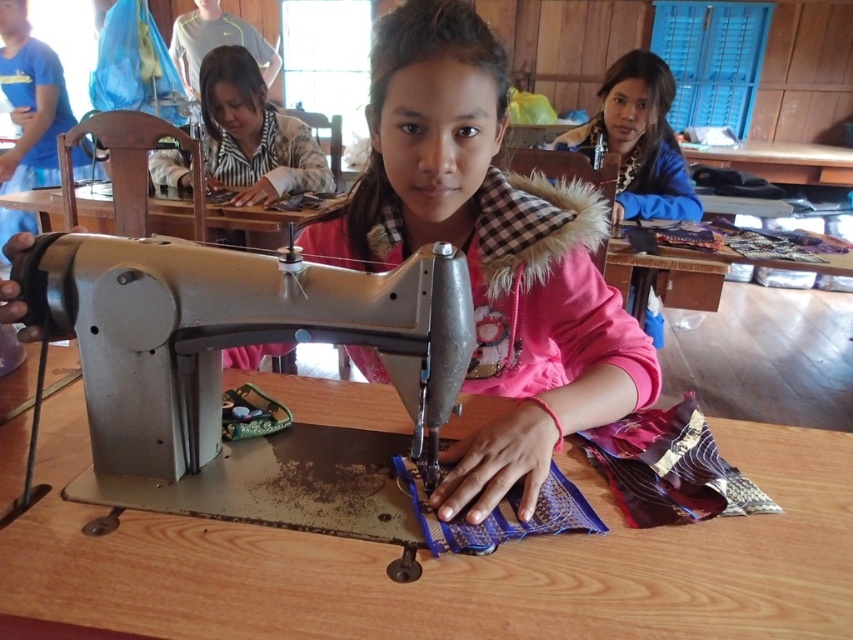
Is wooden table at center closer to camera compared to striped shirt at upper left?

That is True.

Based on the photo, does wooden table at center come behind striped shirt at upper left?

No, wooden table at center is closer to the viewer.

Is point (149, 577) in front of point (264, 164)?

Yes, point (149, 577) is in front of point (264, 164).

Locate an element on the screen. This screenshot has width=853, height=640. wooden table at center is located at coordinates (450, 563).

Who is positioned more to the left, pink fleece jacket at center or striped shirt at upper left?

striped shirt at upper left

Who is lower down, pink fleece jacket at center or striped shirt at upper left?

pink fleece jacket at center is below.

Which is in front, point (648, 400) or point (207, 77)?

Point (648, 400) is in front.

Locate an element on the screen. This screenshot has width=853, height=640. pink fleece jacket at center is located at coordinates (488, 252).

Which of these two, pink fleece jacket at center or metallic sewing machine at center, stands taller?

pink fleece jacket at center

Is point (595, 243) positioned in front of point (71, 257)?

No, (595, 243) is behind (71, 257).

Does point (579, 257) come farther from viewer compared to point (207, 396)?

That is True.

In order to click on pink fleece jacket at center in this screenshot , I will do `click(488, 252)`.